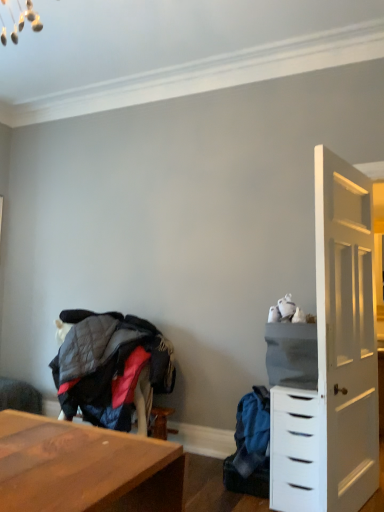
Question: Does white matte chest of drawers at right come behind blue fabric backpack at lower right, positioned as the second clothing in left-to-right order?

Choices:
 (A) no
 (B) yes

Answer: (A)

Question: Does white matte chest of drawers at right have a greater width compared to blue fabric backpack at lower right, positioned as the second clothing in left-to-right order?

Choices:
 (A) yes
 (B) no

Answer: (A)

Question: Would you say white matte chest of drawers at right is a long distance from blue fabric backpack at lower right, acting as the first clothing starting from the right?

Choices:
 (A) no
 (B) yes

Answer: (A)

Question: From the image's perspective, would you say white matte chest of drawers at right is positioned over blue fabric backpack at lower right, positioned as the second clothing in left-to-right order?

Choices:
 (A) no
 (B) yes

Answer: (B)

Question: Is white matte chest of drawers at right taller than blue fabric backpack at lower right, positioned as the second clothing in left-to-right order?

Choices:
 (A) no
 (B) yes

Answer: (B)

Question: Does point (115, 386) appear closer or farther from the camera than point (236, 423)?

Choices:
 (A) farther
 (B) closer

Answer: (B)

Question: Is quilted fabric jacket at lower left, which is counted as the 1th clothing, starting from the left, inside or outside of blue fabric backpack at lower right, acting as the first clothing starting from the right?

Choices:
 (A) outside
 (B) inside

Answer: (A)

Question: Looking at their shapes, would you say quilted fabric jacket at lower left, which is counted as the 2th clothing, starting from the right, is wider or thinner than blue fabric backpack at lower right, positioned as the second clothing in left-to-right order?

Choices:
 (A) thin
 (B) wide

Answer: (A)

Question: Considering the relative positions of quilted fabric jacket at lower left, which is counted as the 2th clothing, starting from the right, and blue fabric backpack at lower right, positioned as the second clothing in left-to-right order, in the image provided, is quilted fabric jacket at lower left, which is counted as the 2th clothing, starting from the right, to the left or to the right of blue fabric backpack at lower right, positioned as the second clothing in left-to-right order,?

Choices:
 (A) right
 (B) left

Answer: (B)

Question: Does point (311, 407) appear closer or farther from the camera than point (266, 392)?

Choices:
 (A) farther
 (B) closer

Answer: (B)

Question: Choose the correct answer: Is white matte chest of drawers at right inside blue fabric backpack at lower right, positioned as the second clothing in left-to-right order, or outside it?

Choices:
 (A) outside
 (B) inside

Answer: (A)

Question: Considering the positions of white matte chest of drawers at right and blue fabric backpack at lower right, positioned as the second clothing in left-to-right order, in the image, is white matte chest of drawers at right wider or thinner than blue fabric backpack at lower right, positioned as the second clothing in left-to-right order,?

Choices:
 (A) thin
 (B) wide

Answer: (B)

Question: Relative to blue fabric backpack at lower right, acting as the first clothing starting from the right, is white matte chest of drawers at right in front or behind?

Choices:
 (A) front
 (B) behind

Answer: (A)

Question: Looking at their shapes, would you say quilted fabric jacket at lower left, which is counted as the 1th clothing, starting from the left, is wider or thinner than white matte chest of drawers at right?

Choices:
 (A) thin
 (B) wide

Answer: (A)

Question: Would you say quilted fabric jacket at lower left, which is counted as the 2th clothing, starting from the right, is inside or outside white matte chest of drawers at right?

Choices:
 (A) inside
 (B) outside

Answer: (B)